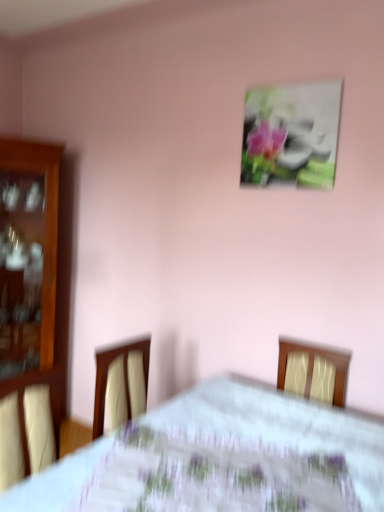
Question: From a real-world perspective, relative to metallic silver frame at upper center, is white floral tablecloth at center vertically above or below?

Choices:
 (A) above
 (B) below

Answer: (B)

Question: From the image's perspective, relative to metallic silver frame at upper center, is white floral tablecloth at center above or below?

Choices:
 (A) below
 (B) above

Answer: (A)

Question: Estimate the real-world distances between objects in this image. Which object is closer to the white floral tablecloth at center?

Choices:
 (A) metallic silver frame at upper center
 (B) wooden cabinet at left

Answer: (A)

Question: Which object is positioned closest to the wooden cabinet at left?

Choices:
 (A) metallic silver frame at upper center
 (B) white floral tablecloth at center

Answer: (A)